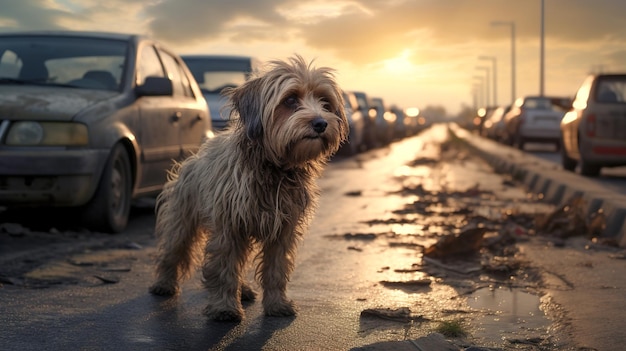
Identify the location of visible lamps. This screenshot has width=626, height=351. (543, 48), (516, 63), (495, 85), (488, 71), (479, 76).